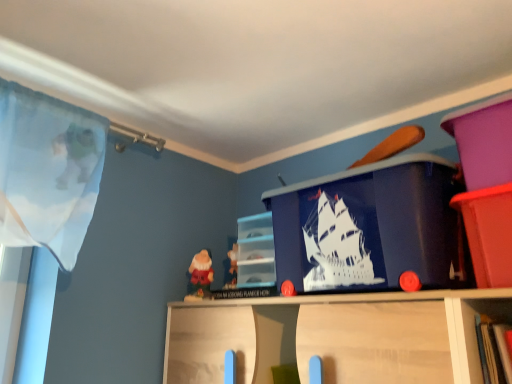
This screenshot has width=512, height=384. What do you see at coordinates (256, 252) in the screenshot?
I see `matte plastic cabinet at center, the second cabinet positioned from the right` at bounding box center [256, 252].

Where is `matte plastic bin at upper right, placed as the first cabinet when sorted from right to left`? Image resolution: width=512 pixels, height=384 pixels. matte plastic bin at upper right, placed as the first cabinet when sorted from right to left is located at coordinates (488, 233).

Locate an element on the screen. The image size is (512, 384). blue plastic ship at center is located at coordinates (367, 227).

Locate an element on the screen. matte plastic cabinet at center, placed as the first cabinet when sorted from left to right is located at coordinates (256, 252).

Considering the relative sizes of blue plastic ship at center and matte plastic cabinet at center, placed as the first cabinet when sorted from left to right, in the image provided, is blue plastic ship at center wider than matte plastic cabinet at center, placed as the first cabinet when sorted from left to right,?

Yes.

Does point (289, 227) appear closer or farther from the camera than point (266, 217)?

Clearly, point (289, 227) is closer to the camera than point (266, 217).

Considering the sizes of objects blue plastic ship at center and matte plastic cabinet at center, the 1th cabinet viewed from the back, in the image provided, who is taller, blue plastic ship at center or matte plastic cabinet at center, the 1th cabinet viewed from the back,?

blue plastic ship at center is taller.

Looking at this image, considering the positions of objects blue plastic ship at center and matte plastic cabinet at center, placed as the first cabinet when sorted from left to right, in the image provided, who is behind, blue plastic ship at center or matte plastic cabinet at center, placed as the first cabinet when sorted from left to right,?

matte plastic cabinet at center, placed as the first cabinet when sorted from left to right.

From the picture: Can you tell me how much matte plastic bin at upper right, which is counted as the first cabinet, starting from the front, and blue plastic ship at center differ in facing direction?

They differ by 4.41 degrees in their facing directions.

Can you confirm if matte plastic bin at upper right, placed as the first cabinet when sorted from right to left, is positioned to the left of blue plastic ship at center?

No, matte plastic bin at upper right, placed as the first cabinet when sorted from right to left, is not to the left of blue plastic ship at center.

Considering the positions of points (500, 206) and (426, 158), is point (500, 206) closer to camera compared to point (426, 158)?

Yes, point (500, 206) is in front of point (426, 158).

In terms of size, does matte plastic bin at upper right, which is counted as the first cabinet, starting from the front, appear bigger or smaller than blue plastic ship at center?

In the image, matte plastic bin at upper right, which is counted as the first cabinet, starting from the front, appears to be smaller than blue plastic ship at center.

Considering the points (274, 217) and (505, 194), which point is in front, point (274, 217) or point (505, 194)?

Positioned in front is point (505, 194).

How far apart are blue plastic ship at center and matte plastic bin at upper right, which is counted as the first cabinet, starting from the front?

blue plastic ship at center and matte plastic bin at upper right, which is counted as the first cabinet, starting from the front, are 9.03 inches apart.

Could you tell me if blue plastic ship at center is turned towards matte plastic bin at upper right, acting as the second cabinet starting from the left?

No, blue plastic ship at center is not turned towards matte plastic bin at upper right, acting as the second cabinet starting from the left.

In order to click on cabinet that appears on the right of blue plastic ship at center in this screenshot , I will do `click(488, 233)`.

Which object is wider, matte plastic cabinet at center, the 1th cabinet viewed from the back, or blue plastic ship at center?

blue plastic ship at center is wider.

Measure the distance between matte plastic cabinet at center, the second cabinet positioned from the right, and blue plastic ship at center.

The distance of matte plastic cabinet at center, the second cabinet positioned from the right, from blue plastic ship at center is 14.11 inches.

In terms of height, does matte plastic cabinet at center, which is the 2th cabinet in front-to-back order, look taller or shorter compared to blue plastic ship at center?

In the image, matte plastic cabinet at center, which is the 2th cabinet in front-to-back order, appears to be shorter than blue plastic ship at center.

Looking at the image, does matte plastic cabinet at center, placed as the first cabinet when sorted from left to right, seem bigger or smaller compared to blue plastic ship at center?

matte plastic cabinet at center, placed as the first cabinet when sorted from left to right, is smaller than blue plastic ship at center.

Which of these two, matte plastic bin at upper right, acting as the second cabinet starting from the left, or matte plastic cabinet at center, the 1th cabinet viewed from the back, stands shorter?

matte plastic bin at upper right, acting as the second cabinet starting from the left, is shorter.

How many degrees apart are the facing directions of matte plastic bin at upper right, which is counted as the first cabinet, starting from the front, and matte plastic cabinet at center, which is the 2th cabinet in front-to-back order?

3.99 degrees.

Which of these two, matte plastic bin at upper right, which ranks as the 2th cabinet in back-to-front order, or matte plastic cabinet at center, which is the 2th cabinet in front-to-back order, is smaller?

matte plastic cabinet at center, which is the 2th cabinet in front-to-back order.

From the image's perspective, is matte plastic cabinet at center, which is the 2th cabinet in front-to-back order, above or below matte plastic bin at upper right, which ranks as the 2th cabinet in back-to-front order?

Based on their image positions, matte plastic cabinet at center, which is the 2th cabinet in front-to-back order, is located beneath matte plastic bin at upper right, which ranks as the 2th cabinet in back-to-front order.

Between matte plastic cabinet at center, the 1th cabinet viewed from the back, and matte plastic bin at upper right, which ranks as the 2th cabinet in back-to-front order, which one is positioned behind?

matte plastic cabinet at center, the 1th cabinet viewed from the back, is further from the camera.

Can you confirm if matte plastic cabinet at center, the second cabinet positioned from the right, is thinner than matte plastic bin at upper right, which is counted as the first cabinet, starting from the front?

Yes.

Is matte plastic bin at upper right, which is counted as the first cabinet, starting from the front, located within matte plastic cabinet at center, the second cabinet positioned from the right?

That's incorrect, matte plastic bin at upper right, which is counted as the first cabinet, starting from the front, is not inside matte plastic cabinet at center, the second cabinet positioned from the right.

From a real-world perspective, count 1st cabinets downward from the blue plastic ship at center and point to it. Please provide its 2D coordinates.

[(256, 252)]

Locate an element on the screen. Image resolution: width=512 pixels, height=384 pixels. window screen that appears behind the matte plastic bin at upper right, which ranks as the 2th cabinet in back-to-front order is located at coordinates (367, 227).

Which object lies nearer to the anchor point matte plastic bin at upper right, which is counted as the first cabinet, starting from the front, matte plastic cabinet at center, the second cabinet positioned from the right, or blue plastic ship at center?

blue plastic ship at center.

From the picture: Estimate the real-world distances between objects in this image. Which object is further from matte plastic bin at upper right, which ranks as the 2th cabinet in back-to-front order, blue plastic ship at center or matte plastic cabinet at center, the 1th cabinet viewed from the back?

matte plastic cabinet at center, the 1th cabinet viewed from the back, lies further to matte plastic bin at upper right, which ranks as the 2th cabinet in back-to-front order, than the other object.

Estimate the real-world distances between objects in this image. Which object is further from matte plastic cabinet at center, the second cabinet positioned from the right, blue plastic ship at center or matte plastic bin at upper right, acting as the second cabinet starting from the left?

The object further to matte plastic cabinet at center, the second cabinet positioned from the right, is matte plastic bin at upper right, acting as the second cabinet starting from the left.

Which object lies nearer to the anchor point blue plastic ship at center, matte plastic cabinet at center, the 1th cabinet viewed from the back, or matte plastic bin at upper right, which ranks as the 2th cabinet in back-to-front order?

matte plastic bin at upper right, which ranks as the 2th cabinet in back-to-front order.

Based on the photo, based on their spatial positions, is matte plastic bin at upper right, acting as the second cabinet starting from the left, or matte plastic cabinet at center, placed as the first cabinet when sorted from left to right, closer to blue plastic ship at center?

The object closer to blue plastic ship at center is matte plastic bin at upper right, acting as the second cabinet starting from the left.

Looking at the image, which one is located closer to matte plastic cabinet at center, placed as the first cabinet when sorted from left to right, matte plastic bin at upper right, acting as the second cabinet starting from the left, or blue plastic ship at center?

Among the two, blue plastic ship at center is located nearer to matte plastic cabinet at center, placed as the first cabinet when sorted from left to right.

What are the coordinates of `window screen between matte plastic cabinet at center, the second cabinet positioned from the right, and matte plastic bin at upper right, which ranks as the 2th cabinet in back-to-front order, in the horizontal direction` in the screenshot? It's located at (367, 227).